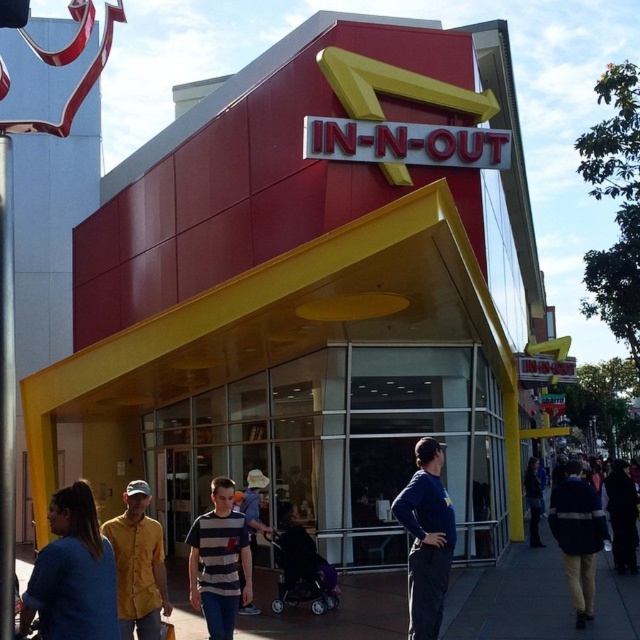
You are standing on the dark gray concrete sidewalk at lower center and want to reach the dark blue jacket at center. In which direction should you move?

The dark gray concrete sidewalk at lower center is to the left of the dark blue jacket at center, so you should move to the right to reach it.

You are a photographer standing in front of the In N Out Burger restaurant. You notice a person wearing a striped cotton shirt at center and another wearing a black matte jacket at lower right. Which clothing item is shorter in height?

The striped cotton shirt at center has a lesser height compared to the black matte jacket at lower right, so the striped cotton shirt at center is shorter in height.